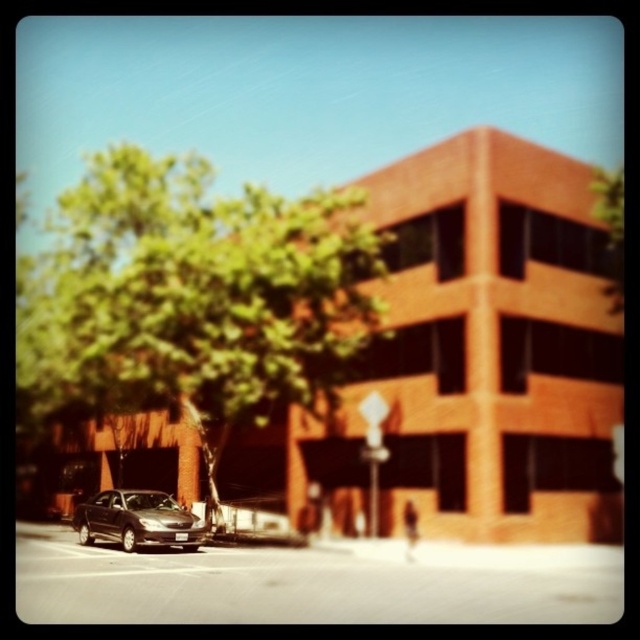
You are a city planner evaluating the urban scene. The green leafy tree at upper left and the shiny dark gray sedan at lower left are both in view. Which object occupies more horizontal space in the image?

The green leafy tree at upper left occupies more horizontal space than the shiny dark gray sedan at lower left because its width is larger according to the description.

You are a delivery person trying to park your van next to the shiny dark gray sedan at lower left. The van is 2 meters taller than the sedan. Can you park the van without hitting the green leafy tree at upper left?

The green leafy tree at upper left is much taller than the shiny dark gray sedan at lower left. Since the van is 2 meters taller than the sedan, it might hit the tree if parked there.

You are a photographer trying to capture the entire building and the trees in one shot. Given the sizes of the green leafy tree at upper left and the shiny dark gray sedan at lower left, which object might block your view of the building more?

The green leafy tree at upper left is larger in size than the shiny dark gray sedan at lower left, so it would block the view of the building more.